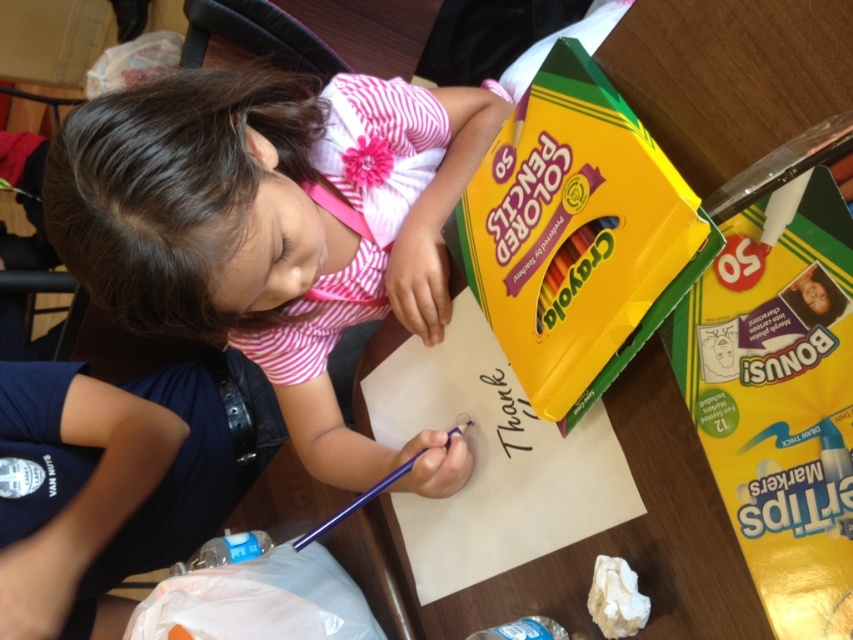
Between smooth pink shirt at center and white crumpled paper at lower center, which one has more height?

With more height is smooth pink shirt at center.

Which is in front, point (312, 214) or point (625, 616)?

Point (625, 616) is in front.

The width and height of the screenshot is (853, 640). Identify the location of smooth pink shirt at center. (276, 228).

The height and width of the screenshot is (640, 853). What do you see at coordinates (576, 236) in the screenshot? I see `matte yellow crayola colored pencils at upper right` at bounding box center [576, 236].

Looking at this image, does matte yellow crayola colored pencils at upper right appear over white crumpled paper at lower center?

Correct, matte yellow crayola colored pencils at upper right is located above white crumpled paper at lower center.

Is point (497, 275) positioned in front of point (624, 582)?

No, it is not.

Locate an element on the screen. The width and height of the screenshot is (853, 640). matte yellow crayola colored pencils at upper right is located at coordinates (576, 236).

Does yellow glossy markers at right appear under white crumpled paper at lower center?

No, yellow glossy markers at right is not below white crumpled paper at lower center.

Is point (791, 572) in front of point (622, 630)?

Yes, point (791, 572) is closer to viewer.

Locate an element on the screen. yellow glossy markers at right is located at coordinates (779, 401).

At what (x,y) coordinates should I click in order to perform the action: click on yellow glossy markers at right. Please return your answer as a coordinate pair (x, y). This screenshot has width=853, height=640. Looking at the image, I should click on (779, 401).